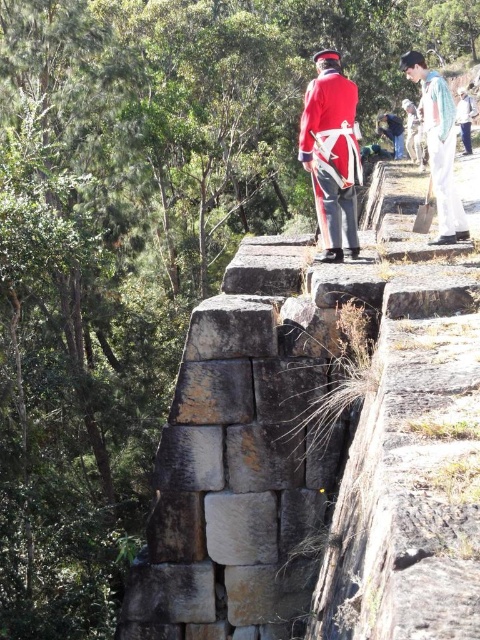
You are a historian analyzing the image. The rustic stone wall at center is marked by a point at coordinates (321, 452). What does this point indicate about the wall?

The point at coordinates (321, 452) marks the rustic stone wall at center, indicating its central position in the scene.

You are a painter setting up an easel to capture the rustic stone wall at center and the red woolen coat at upper center. Which object should you position closer to the edge of your canvas to ensure proper perspective, considering their relative sizes?

The red woolen coat at upper center should be positioned closer to the edge of the canvas because the rustic stone wall at center is wider than the red woolen coat at upper center, so to maintain perspective, the smaller object should be placed near the edge while the larger one occupies more central space.

You are a painter who wants to capture the scene of the rustic stone wall at center and the red woolen coat at upper center in a painting. Which object should you paint first if you follow the rule of painting larger objects before smaller ones?

The rustic stone wall at center should be painted first because it has a greater height compared to the red woolen coat at upper center, making it larger.